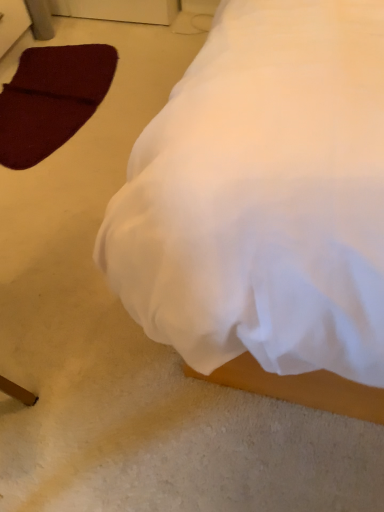
Question: From a real-world perspective, is maroon felt pad at lower left positioned above or below white fabric bed at lower right?

Choices:
 (A) below
 (B) above

Answer: (A)

Question: Considering the positions of maroon felt pad at lower left and white fabric bed at lower right in the image, is maroon felt pad at lower left wider or thinner than white fabric bed at lower right?

Choices:
 (A) wide
 (B) thin

Answer: (B)

Question: Is point (67, 132) positioned closer to the camera than point (266, 26)?

Choices:
 (A) closer
 (B) farther

Answer: (B)

Question: From the image's perspective, relative to maroon felt pad at lower left, is white fabric bed at lower right above or below?

Choices:
 (A) above
 (B) below

Answer: (B)

Question: Is white fabric bed at lower right in front of or behind maroon felt pad at lower left in the image?

Choices:
 (A) behind
 (B) front

Answer: (B)

Question: Is white fabric bed at lower right to the left or to the right of maroon felt pad at lower left in the image?

Choices:
 (A) left
 (B) right

Answer: (B)

Question: Is white fabric bed at lower right wider or thinner than maroon felt pad at lower left?

Choices:
 (A) thin
 (B) wide

Answer: (B)